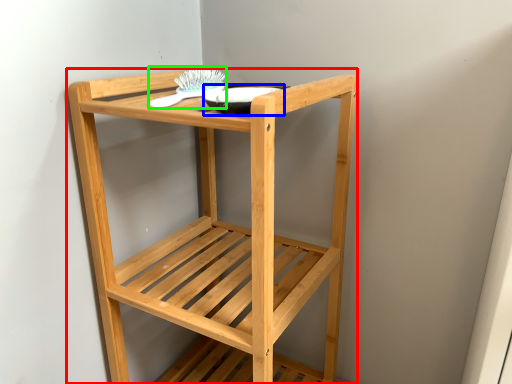
Question: Which is farther away from furniture (highlighted by a red box)? glass bowl (highlighted by a blue box) or brush (highlighted by a green box)?

Choices:
 (A) glass bowl
 (B) brush

Answer: (B)